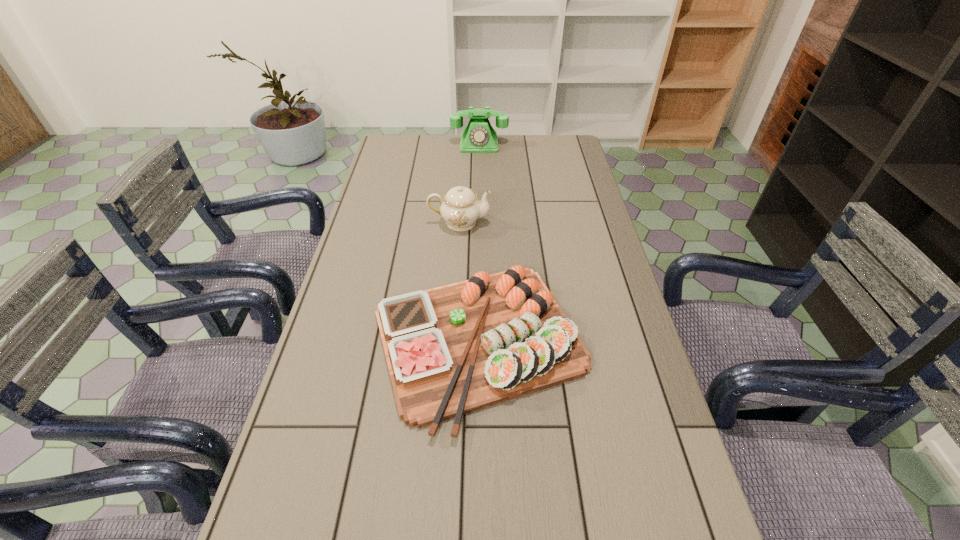
Identify the location of telephone. (479, 136).

Where is `the second nearest object`? Image resolution: width=960 pixels, height=540 pixels. the second nearest object is located at coordinates (460, 208).

Find the location of a particular element. This screenshot has width=960, height=540. the nearest object is located at coordinates (451, 350).

The image size is (960, 540). I want to click on the shortest object, so click(x=451, y=350).

Find the location of a particular element. The width and height of the screenshot is (960, 540). free region located 0.200m on the dial of the farthest object is located at coordinates (479, 180).

Locate an element on the screen. Image resolution: width=960 pixels, height=540 pixels. vacant region located 0.150m at the spout of the chinaware is located at coordinates (537, 222).

Where is `vacant area situated 0.140m on the front of the platter`? This screenshot has height=540, width=960. vacant area situated 0.140m on the front of the platter is located at coordinates (478, 515).

Locate an element on the screen. The height and width of the screenshot is (540, 960). object present at the far edge is located at coordinates (479, 136).

You are a GUI agent. You are given a task and a screenshot of the screen. Output one action in this format:
    pyautogui.click(x=<x>, y=<y>)
    Task: Click on the object that is at the left edge
    The height and width of the screenshot is (540, 960).
    Given the screenshot: What is the action you would take?
    pyautogui.click(x=451, y=350)

The image size is (960, 540). In order to click on object present at the right edge in this screenshot , I will do `click(451, 350)`.